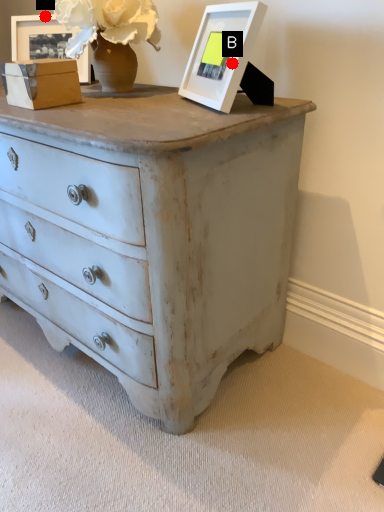
Question: Two points are circled on the image, labeled by A and B beside each circle. Which point is farther to the camera?

Choices:
 (A) A is further
 (B) B is further

Answer: (A)